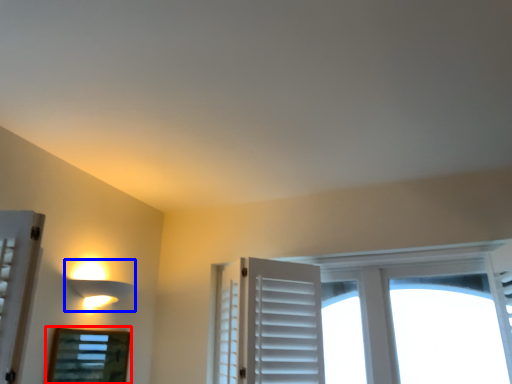
Question: Which object is further to the camera taking this photo, bay window (highlighted by a red box) or lamp (highlighted by a blue box)?

Choices:
 (A) bay window
 (B) lamp

Answer: (B)